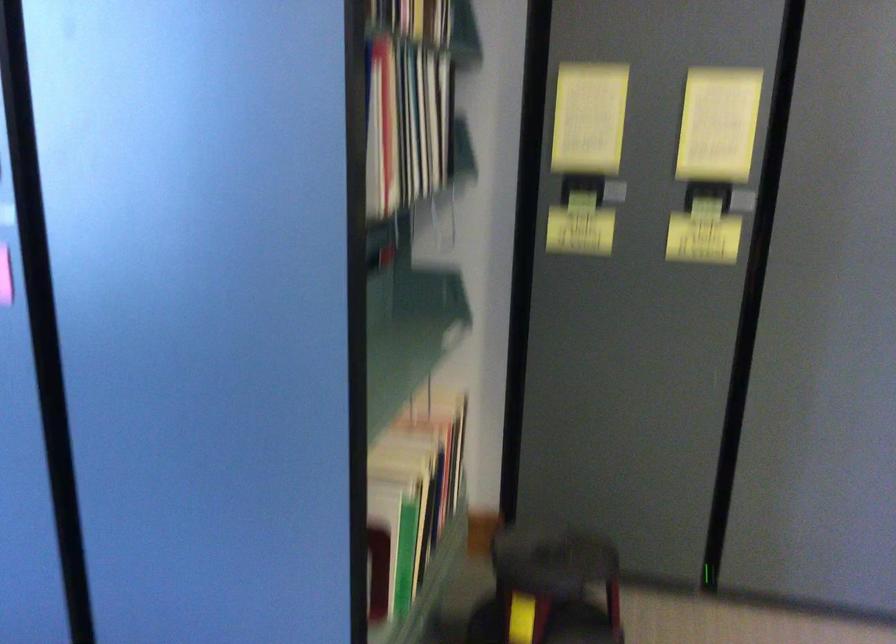
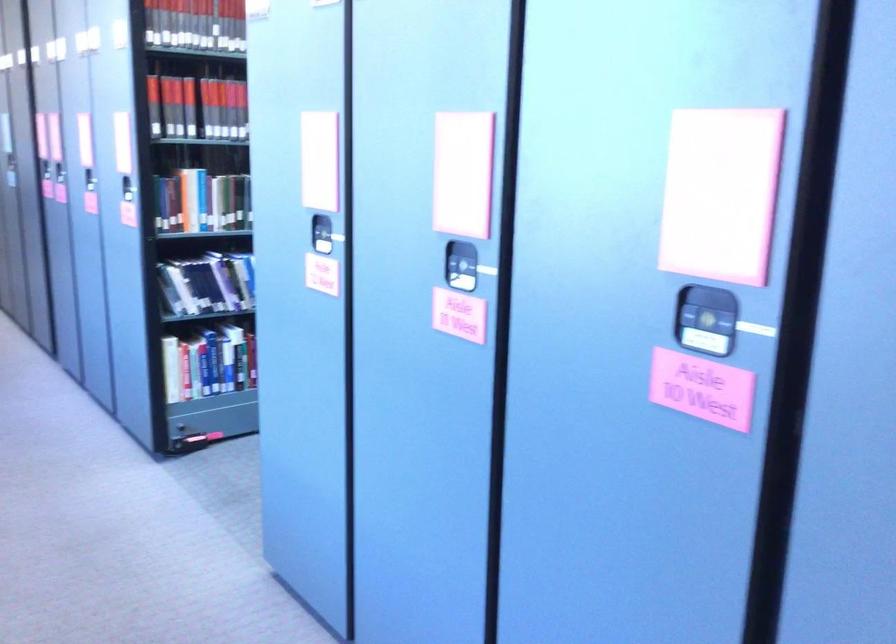
Question: Based on the continuous images, in which direction is the camera rotating? Reply with the corresponding letter.

Choices:
 (A) Left
 (B) Right
 (C) Up
 (D) Down

Answer: (A)